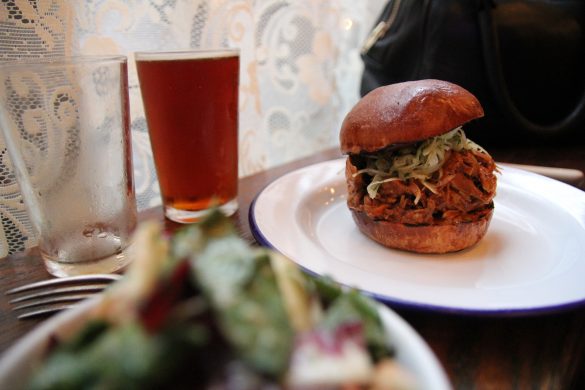
Locate an element on the screen. The height and width of the screenshot is (390, 585). lace tablecloth is located at coordinates (268, 33).